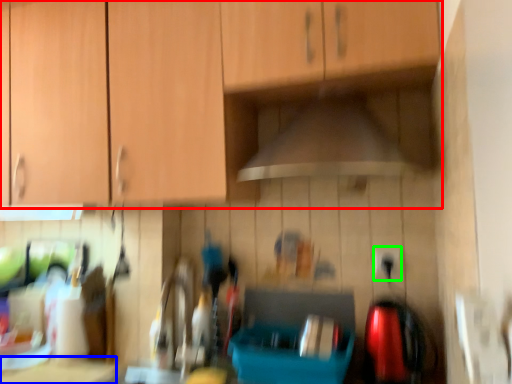
Question: Which object is the farthest from cabinetry (highlighted by a red box)? Choose among these: counter top (highlighted by a blue box) or electric outlet (highlighted by a green box).

Choices:
 (A) counter top
 (B) electric outlet

Answer: (A)